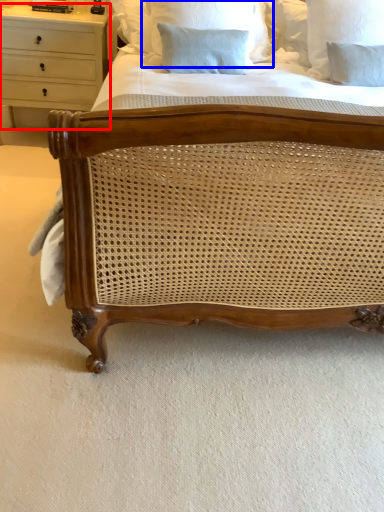
Question: Which of the following is the closest to the observer, chest of drawers (highlighted by a red box) or pillow (highlighted by a blue box)?

Choices:
 (A) chest of drawers
 (B) pillow

Answer: (B)